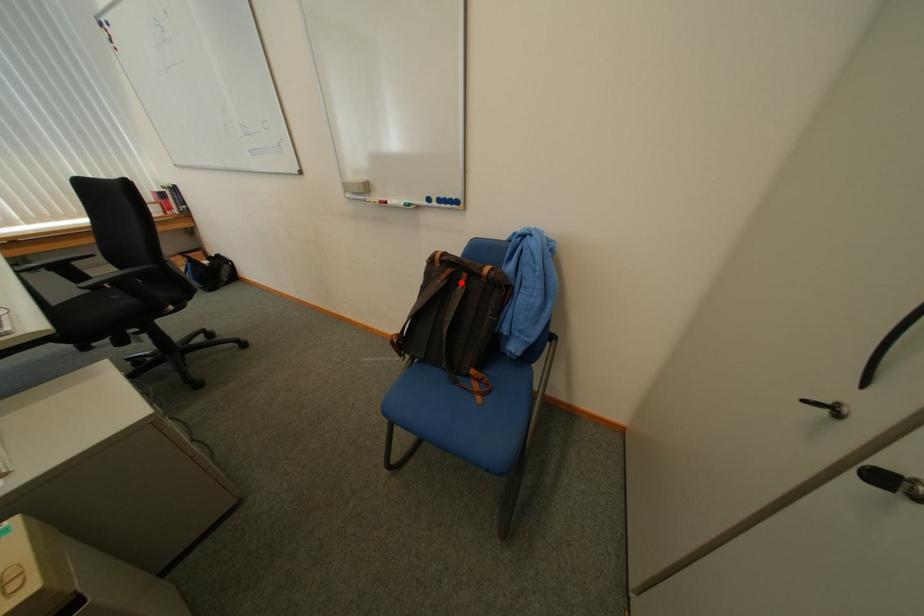
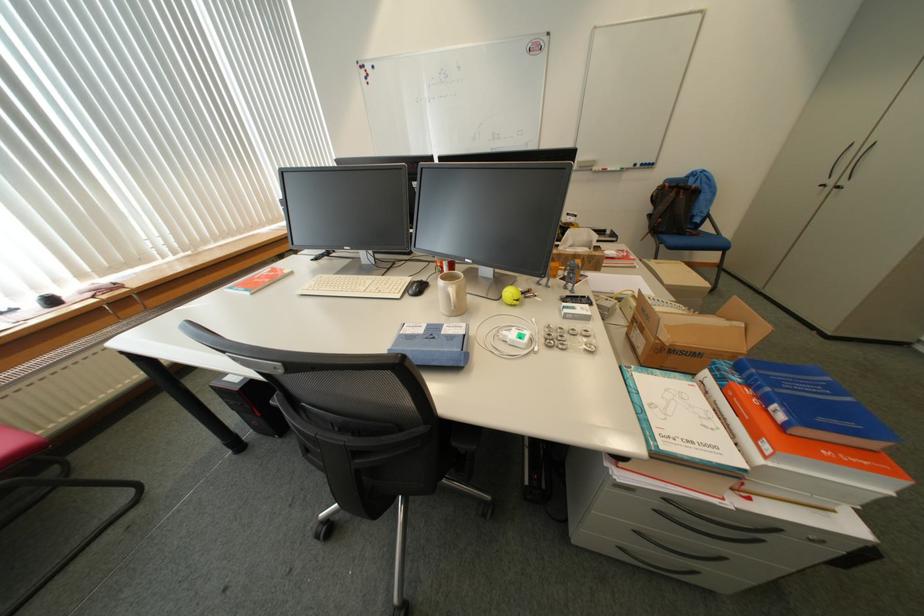
The point at the highlighted location is marked in the first image. Where is the corresponding point in the second image?

(687, 195)